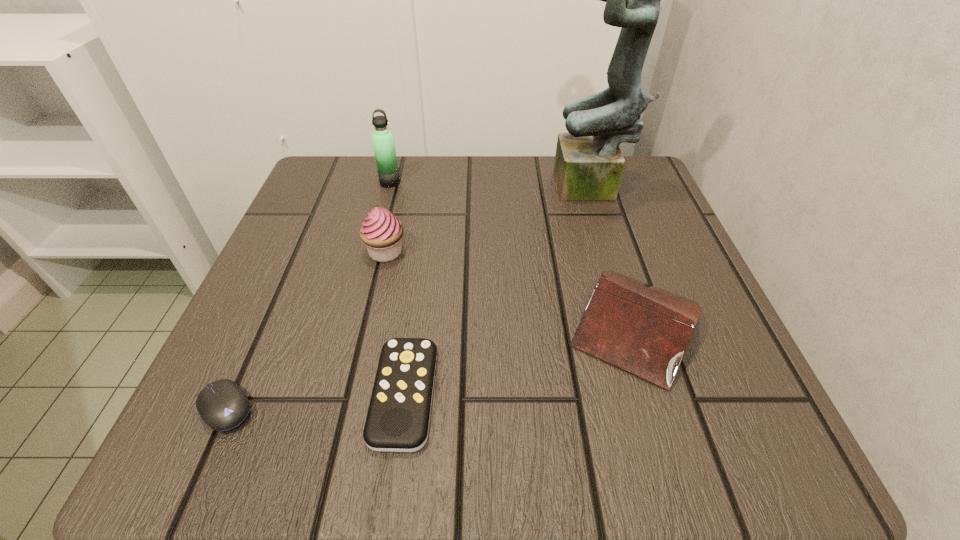
This screenshot has height=540, width=960. In order to click on blank space at the far left corner of the desktop in this screenshot , I will do `click(353, 184)`.

You are a GUI agent. You are given a task and a screenshot of the screen. Output one action in this format:
    pyautogui.click(x=<x>, y=<y>)
    Task: Click on the vacant space at the far right corner of the desktop
    The width and height of the screenshot is (960, 540).
    Given the screenshot: What is the action you would take?
    pyautogui.click(x=626, y=185)

Locate an element on the screen. This screenshot has height=540, width=960. vacant point located between the computer mouse and the remote control is located at coordinates (315, 401).

The image size is (960, 540). What are the coordinates of `free spot between the third farthest object and the book` in the screenshot? It's located at (511, 288).

Find the location of `free spot between the computer mouse and the sculpture`. free spot between the computer mouse and the sculpture is located at coordinates (410, 299).

Identify the location of free spot between the remote control and the thermos bottle. This screenshot has width=960, height=540. (397, 288).

You are a GUI agent. You are given a task and a screenshot of the screen. Output one action in this format:
    pyautogui.click(x=<x>, y=<y>)
    Task: Click on the unoccupied area between the computer mouse and the remote control
    The width and height of the screenshot is (960, 540).
    Given the screenshot: What is the action you would take?
    pyautogui.click(x=315, y=401)

Where is `vacant space that is in between the remote control and the fourth shortest object`? vacant space that is in between the remote control and the fourth shortest object is located at coordinates (395, 323).

What are the coordinates of `the fifth closest object to the sculpture` in the screenshot? It's located at (223, 405).

Image resolution: width=960 pixels, height=540 pixels. I want to click on object that can be found as the fourth closest to the second tallest object, so click(398, 418).